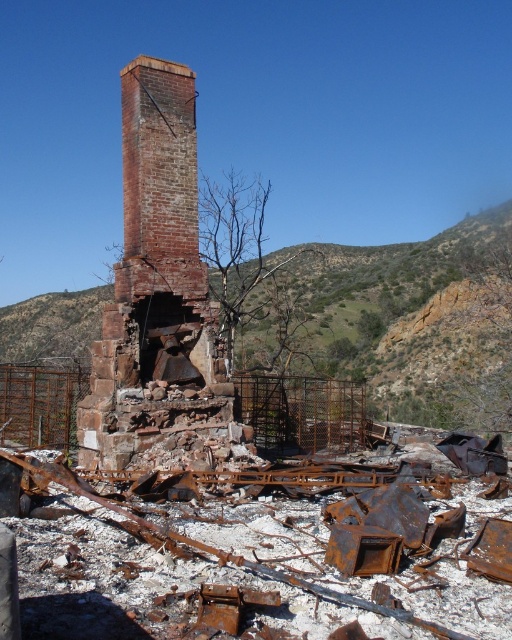
Question: Which point is farther from the camera taking this photo?

Choices:
 (A) (118, 364)
 (B) (397, 353)

Answer: (B)

Question: Which point is farther from the camera taking this photo?

Choices:
 (A) (126, 186)
 (B) (501, 243)

Answer: (B)

Question: Is rusty metal hillside at center further to camera compared to rusty brick chimney at center?

Choices:
 (A) no
 (B) yes

Answer: (B)

Question: Can you confirm if rusty metal hillside at center is positioned to the right of rusty brick chimney at center?

Choices:
 (A) yes
 (B) no

Answer: (A)

Question: Can you confirm if rusty metal hillside at center is smaller than rusty brick chimney at center?

Choices:
 (A) no
 (B) yes

Answer: (A)

Question: Which point is closer to the camera?

Choices:
 (A) rusty metal hillside at center
 (B) rusty brick chimney at center

Answer: (B)